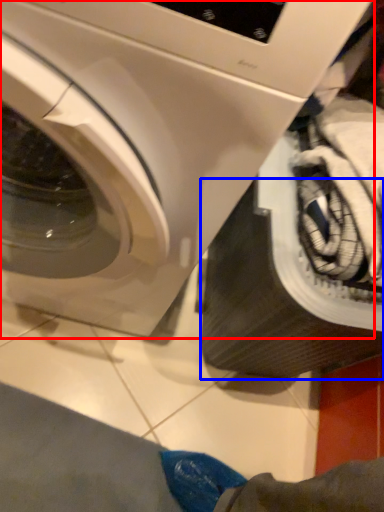
Question: Among these objects, which one is farthest to the camera, washing machine (highlighted by a red box) or tire (highlighted by a blue box)?

Choices:
 (A) washing machine
 (B) tire

Answer: (B)